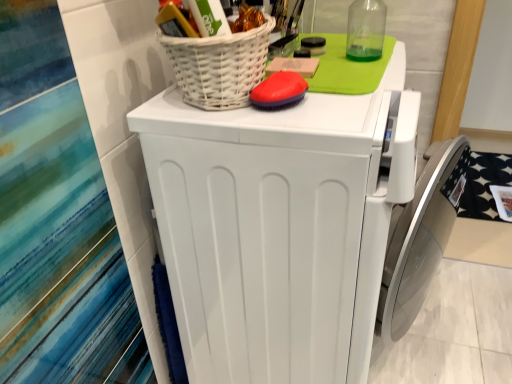
Find the location of a particular element. The height and width of the screenshot is (384, 512). free location in front of red rubber brush at upper center is located at coordinates (295, 121).